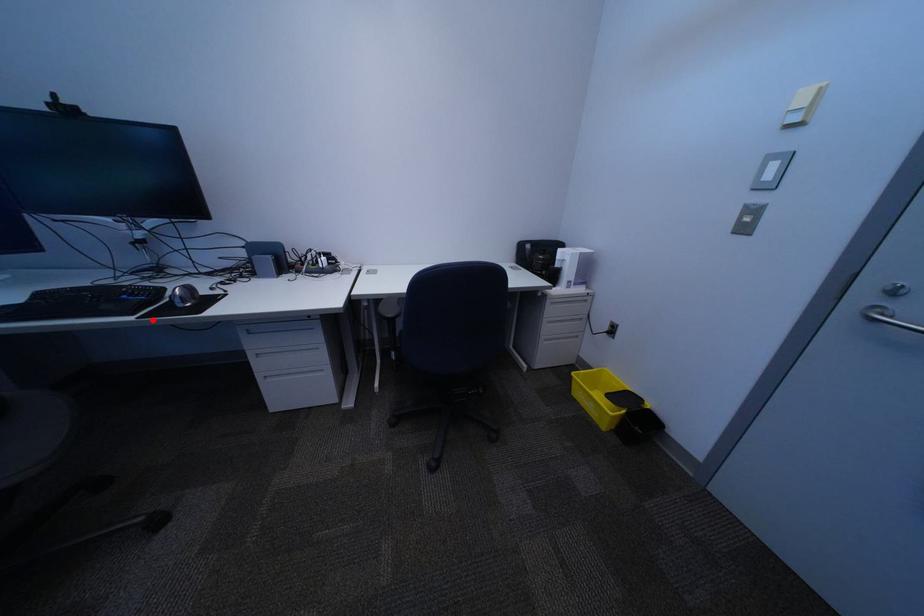
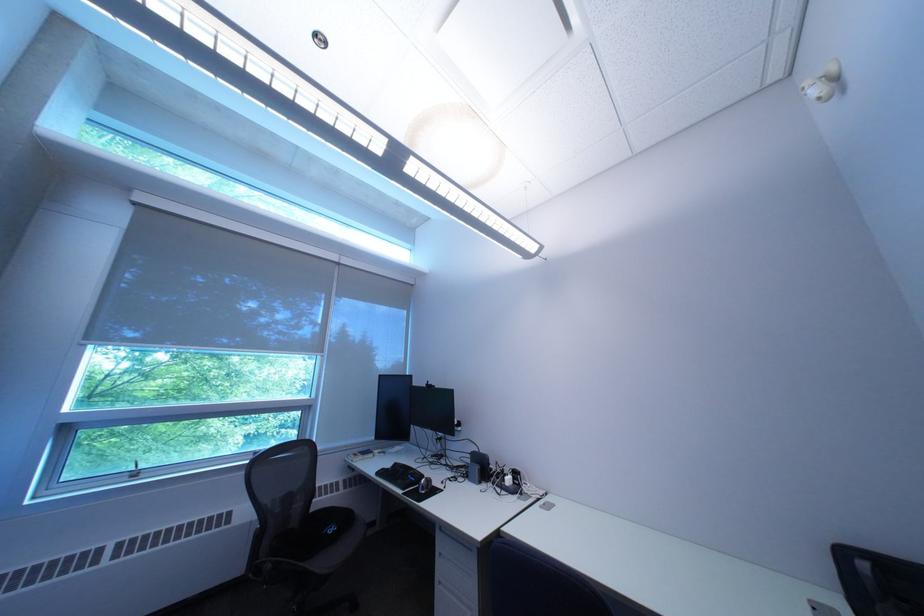
The point at the highlighted location is marked in the first image. Where is the corresponding point in the second image?

(418, 495)